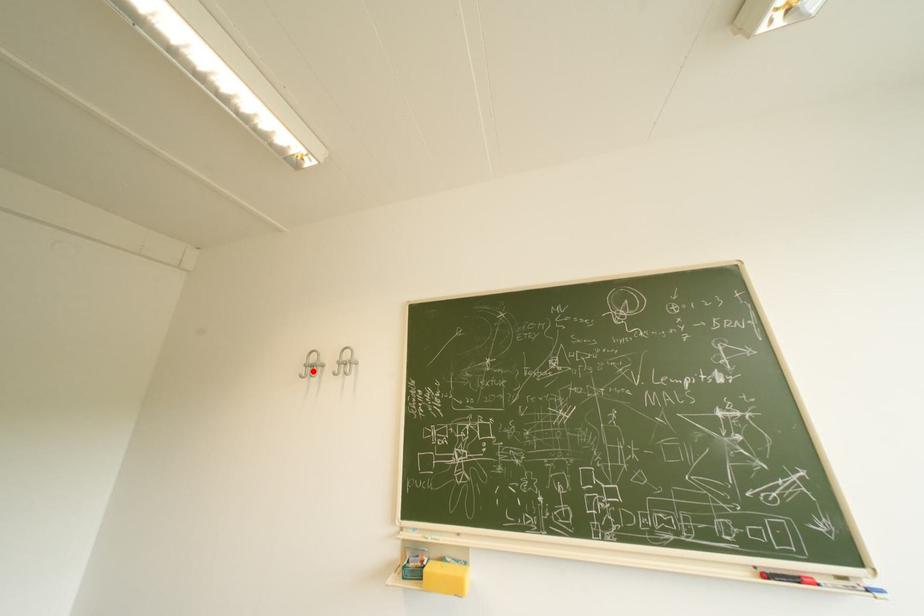
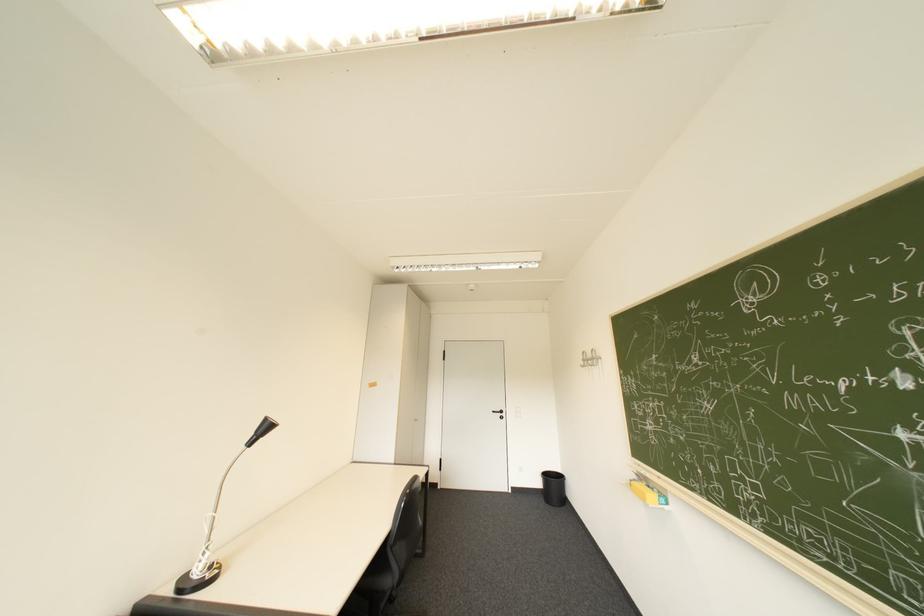
Locate, in the second image, the point that corresponds to the highlighted location in the first image.

(591, 363)